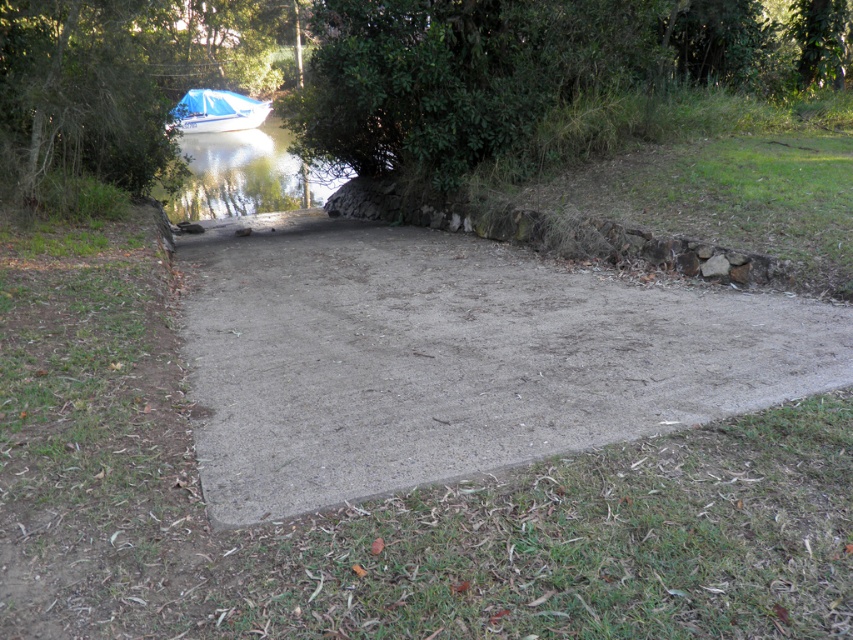
Question: Is dull concrete path at center positioned at the back of green leafy tree at upper left?

Choices:
 (A) yes
 (B) no

Answer: (B)

Question: Does blue glossy water at upper left appear on the left side of blue tarpaulin boat at upper left?

Choices:
 (A) yes
 (B) no

Answer: (B)

Question: Can you confirm if green leafy tree at upper left is wider than blue tarpaulin boat at upper left?

Choices:
 (A) no
 (B) yes

Answer: (A)

Question: Among these points, which one is farthest from the camera?

Choices:
 (A) (172, 116)
 (B) (334, 170)
 (C) (167, 51)
 (D) (445, 120)

Answer: (C)

Question: Which object is closer to the camera taking this photo?

Choices:
 (A) dull concrete path at center
 (B) blue glossy water at upper left
 (C) blue tarpaulin boat at upper left
 (D) green leafy tree at upper left

Answer: (A)

Question: Which point is farther to the camera?

Choices:
 (A) blue glossy water at upper left
 (B) dull concrete path at center

Answer: (A)